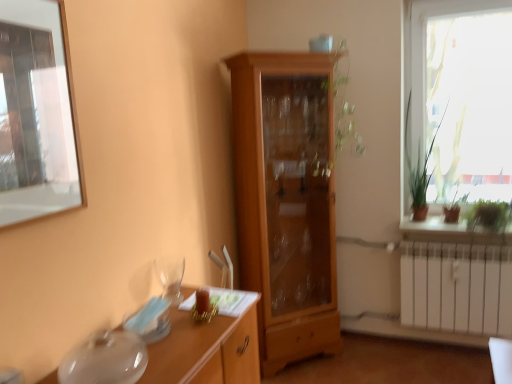
What do you see at coordinates (489, 215) in the screenshot? I see `green leafy plant at right, the second plant from the left` at bounding box center [489, 215].

The image size is (512, 384). Identify the location of transparent glass desk at lower left. (206, 350).

What do you see at coordinates (419, 164) in the screenshot? I see `green leafy plant at right, which is counted as the first plant, starting from the left` at bounding box center [419, 164].

The height and width of the screenshot is (384, 512). Describe the element at coordinates (37, 113) in the screenshot. I see `transparent glass window screen at upper left` at that location.

At what (x,y) coordinates should I click in order to perform the action: click on green leafy plant at right, the second plant from the left. Please return your answer as a coordinate pair (x, y). The width and height of the screenshot is (512, 384). Looking at the image, I should click on [x=489, y=215].

Is transparent glass window screen at upper left next to transparent glass window at right and touching it?

No, transparent glass window screen at upper left is not next to transparent glass window at right.

From the image's perspective, is transparent glass window screen at upper left positioned above or below transparent glass window at right?

From the image's perspective, transparent glass window screen at upper left appears below transparent glass window at right.

From the picture: Is transparent glass window screen at upper left taller than transparent glass window at right?

No.

From the image's perspective, between clear glass wine glass at lower left and transparent glass window at right, who is located below?

clear glass wine glass at lower left.

Does clear glass wine glass at lower left contain transparent glass window at right?

No.

Considering the relative sizes of clear glass wine glass at lower left and transparent glass window at right in the image provided, is clear glass wine glass at lower left thinner than transparent glass window at right?

No, clear glass wine glass at lower left is not thinner than transparent glass window at right.

Could you tell me if clear glass wine glass at lower left is facing transparent glass window at right?

No, clear glass wine glass at lower left is not facing towards transparent glass window at right.

Is transparent glass desk at lower left inside or outside of green leafy plant at right, arranged as the second plant when viewed from the right?

transparent glass desk at lower left cannot be found inside green leafy plant at right, arranged as the second plant when viewed from the right.

Which of these two, transparent glass desk at lower left or green leafy plant at right, which is counted as the first plant, starting from the left, is thinner?

green leafy plant at right, which is counted as the first plant, starting from the left.

Is transparent glass desk at lower left bigger or smaller than green leafy plant at right, arranged as the second plant when viewed from the right?

Considering their sizes, transparent glass desk at lower left takes up more space than green leafy plant at right, arranged as the second plant when viewed from the right.

How many degrees apart are the facing directions of transparent glass desk at lower left and green leafy plant at right, arranged as the second plant when viewed from the right?

89.2 degrees separate the facing orientations of transparent glass desk at lower left and green leafy plant at right, arranged as the second plant when viewed from the right.

You are a GUI agent. You are given a task and a screenshot of the screen. Output one action in this format:
    pyautogui.click(x=<x>, y=<y>)
    Task: Click on the cabinetry above the transparent glass desk at lower left (from a real-world perspective)
    This screenshot has height=384, width=512.
    Given the screenshot: What is the action you would take?
    pyautogui.click(x=286, y=200)

Measure the distance from light brown wood cabinet at center to transparent glass desk at lower left.

They are 31.39 inches apart.

Is light brown wood cabinet at center not close to transparent glass desk at lower left?

light brown wood cabinet at center is near transparent glass desk at lower left, not far away.

Is point (331, 277) closer to viewer compared to point (189, 313)?

No, it is behind (189, 313).

From a real-world perspective, is light brown wood cabinet at center physically located above or below transparent glass window at right?

Clearly, from a real-world perspective, light brown wood cabinet at center is below transparent glass window at right.

Based on the photo, from their relative heights in the image, would you say light brown wood cabinet at center is taller or shorter than transparent glass window at right?

light brown wood cabinet at center is taller than transparent glass window at right.

Is light brown wood cabinet at center looking in the opposite direction of transparent glass window at right?

No, light brown wood cabinet at center's orientation is not away from transparent glass window at right.

The height and width of the screenshot is (384, 512). What are the coordinates of `window behind the light brown wood cabinet at center` in the screenshot? It's located at (462, 98).

Is clear glass wine glass at lower left thinner than green matte plant at right?

Indeed, clear glass wine glass at lower left has a lesser width compared to green matte plant at right.

Is point (181, 280) positioned in front of point (440, 236)?

That is True.

Could you tell me if clear glass wine glass at lower left is turned towards green matte plant at right?

No, clear glass wine glass at lower left is not facing towards green matte plant at right.

Are clear glass wine glass at lower left and green matte plant at right beside each other?

No, clear glass wine glass at lower left is not with green matte plant at right.

Is green leafy plant at right, the first plant from the right, turned away from green leafy plant at right, which is counted as the first plant, starting from the left?

green leafy plant at right, the first plant from the right, is not turned away from green leafy plant at right, which is counted as the first plant, starting from the left.

Does point (490, 207) come in front of point (410, 170)?

Yes, it is in front of point (410, 170).

Where is `window screen that is in front of the transparent glass window at right`? This screenshot has width=512, height=384. window screen that is in front of the transparent glass window at right is located at coordinates (37, 113).

At what (x,y) coordinates should I click in order to perform the action: click on tableware below the transparent glass window at right (from a real-world perspective). Please return your answer as a coordinate pair (x, y). The width and height of the screenshot is (512, 384). Looking at the image, I should click on (170, 277).

When comparing their distances from transparent glass window screen at upper left, does transparent glass desk at lower left or transparent glass window at right seem closer?

transparent glass desk at lower left lies closer to transparent glass window screen at upper left than the other object.

In the scene shown: Which object lies nearer to the anchor point light brown wood cabinet at center, clear glass wine glass at lower left or green leafy plant at right, the first plant from the right?

The object closer to light brown wood cabinet at center is clear glass wine glass at lower left.

Based on the photo, considering their positions, is green leafy plant at right, the first plant from the right, positioned closer to transparent glass window screen at upper left than transparent glass desk at lower left?

transparent glass desk at lower left.

When comparing their distances from green leafy plant at right, which is counted as the first plant, starting from the left, does transparent glass window at right or green matte plant at right seem closer?

The object closer to green leafy plant at right, which is counted as the first plant, starting from the left, is green matte plant at right.

Based on their spatial positions, is clear glass wine glass at lower left or green leafy plant at right, arranged as the second plant when viewed from the right, further from transparent glass window screen at upper left?

green leafy plant at right, arranged as the second plant when viewed from the right, is positioned further to the anchor transparent glass window screen at upper left.

Looking at this image, which object lies nearer to the anchor point green leafy plant at right, the first plant from the right, green leafy plant at right, arranged as the second plant when viewed from the right, or light brown wood cabinet at center?

Among the two, green leafy plant at right, arranged as the second plant when viewed from the right, is located nearer to green leafy plant at right, the first plant from the right.

When comparing their distances from light brown wood cabinet at center, does transparent glass window at right or green leafy plant at right, arranged as the second plant when viewed from the right, seem closer?

green leafy plant at right, arranged as the second plant when viewed from the right, lies closer to light brown wood cabinet at center than the other object.

When comparing their distances from green leafy plant at right, the first plant from the right, does transparent glass desk at lower left or clear glass wine glass at lower left seem closer?

transparent glass desk at lower left is positioned closer to the anchor green leafy plant at right, the first plant from the right.

Identify the location of desk located between clear glass wine glass at lower left and transparent glass window at right in the left-right direction. (206, 350).

Image resolution: width=512 pixels, height=384 pixels. What are the coordinates of `cabinetry located between transparent glass desk at lower left and green matte plant at right in the left-right direction` in the screenshot? It's located at (286, 200).

What are the coordinates of `tableware between transparent glass window screen at upper left and green leafy plant at right, the first plant from the right, from left to right` in the screenshot? It's located at (170, 277).

This screenshot has width=512, height=384. I want to click on cabinetry between clear glass wine glass at lower left and green leafy plant at right, arranged as the second plant when viewed from the right, from left to right, so click(x=286, y=200).